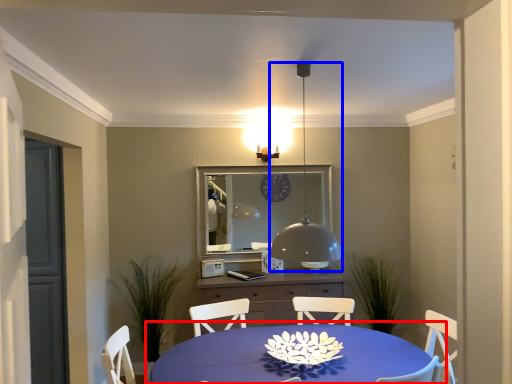
Question: Among these objects, which one is nearest to the camera, table (highlighted by a red box) or lamp (highlighted by a blue box)?

Choices:
 (A) table
 (B) lamp

Answer: (A)